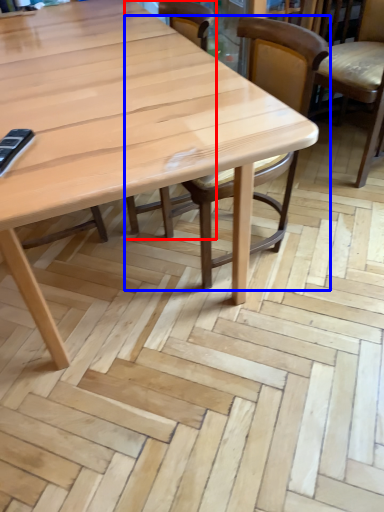
Question: Which of the following is the closest to the observer, chair (highlighted by a red box) or chair (highlighted by a blue box)?

Choices:
 (A) chair
 (B) chair

Answer: (B)